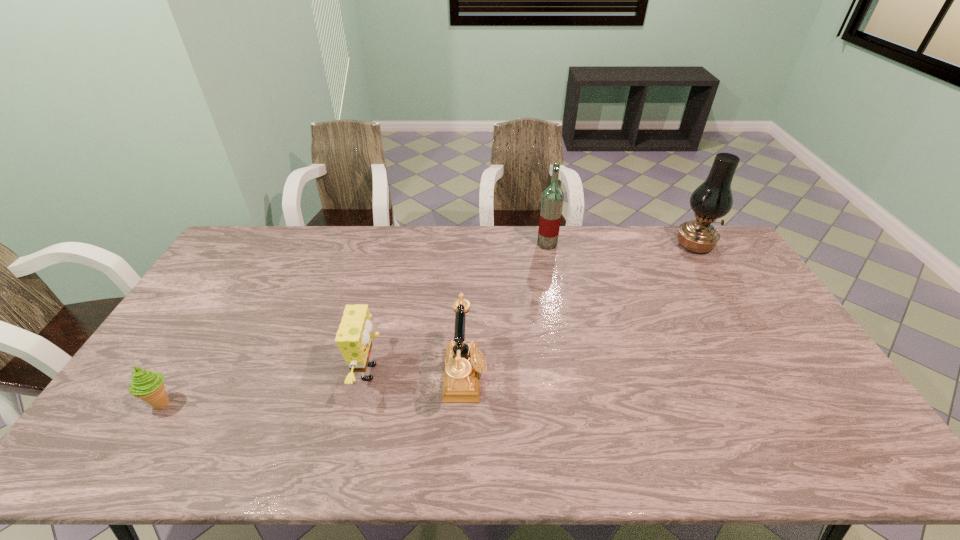
The width and height of the screenshot is (960, 540). In order to click on vacant area between the second object from right to left and the oil lamp in this screenshot , I will do (621, 245).

You are a GUI agent. You are given a task and a screenshot of the screen. Output one action in this format:
    pyautogui.click(x=<x>, y=<y>)
    Task: Click on the vacant area that lies between the rightmost object and the fourth object from left to right
    
    Given the screenshot: What is the action you would take?
    click(x=621, y=245)

I want to click on free space between the third object from left to right and the leftmost object, so click(x=314, y=389).

This screenshot has height=540, width=960. I want to click on vacant area between the oil lamp and the shortest object, so click(428, 324).

At what (x,y) coordinates should I click in order to perform the action: click on vacant space in between the shortest object and the third object from left to right. Please return your answer as a coordinate pair (x, y). Looking at the image, I should click on (314, 389).

Image resolution: width=960 pixels, height=540 pixels. What are the coordinates of `vacant space that's between the telephone and the rightmost object` in the screenshot? It's located at (580, 310).

You are a GUI agent. You are given a task and a screenshot of the screen. Output one action in this format:
    pyautogui.click(x=<x>, y=<y>)
    Task: Click on the unoccupied area between the sponge and the telephone
    
    Given the screenshot: What is the action you would take?
    pyautogui.click(x=419, y=374)

Where is `vacant point located between the third object from right to left and the leftmost object`? Image resolution: width=960 pixels, height=540 pixels. vacant point located between the third object from right to left and the leftmost object is located at coordinates (314, 389).

What are the coordinates of `free spot between the shortest object and the telephone` in the screenshot? It's located at (314, 389).

Identify the location of vacant space that's between the telephone and the liquor. The height and width of the screenshot is (540, 960). (506, 310).